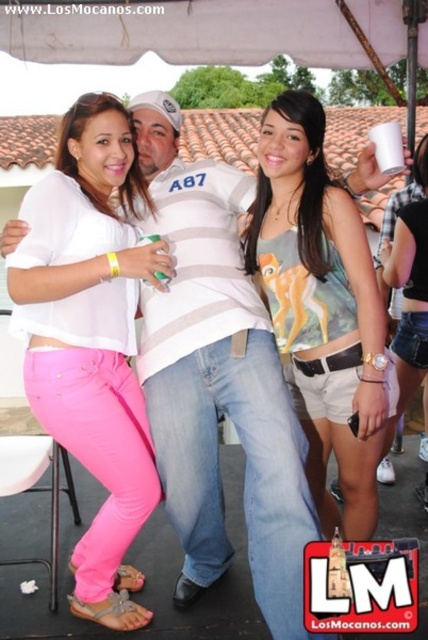
Question: Which point is farther to the camera?

Choices:
 (A) pink fabric stool at lower left
 (B) green plastic cup at center
 (C) white matte cup at upper center
 (D) matte pink pants at center

Answer: (A)

Question: Can you confirm if matte green tank top at center is positioned to the left of green plastic cup at center?

Choices:
 (A) yes
 (B) no

Answer: (B)

Question: Does matte pink pants at center appear over matte green tank top at center?

Choices:
 (A) yes
 (B) no

Answer: (B)

Question: Can you confirm if white fabric canopy at upper center is positioned to the left of pink fabric stool at lower left?

Choices:
 (A) no
 (B) yes

Answer: (A)

Question: Among these objects, which one is nearest to the camera?

Choices:
 (A) matte green tank top at center
 (B) green plastic cup at center
 (C) white matte cup at upper center
 (D) pink fabric stool at lower left

Answer: (A)

Question: Among these objects, which one is farthest from the camera?

Choices:
 (A) pink fabric stool at lower left
 (B) matte pink pants at center
 (C) white fabric canopy at upper center

Answer: (C)